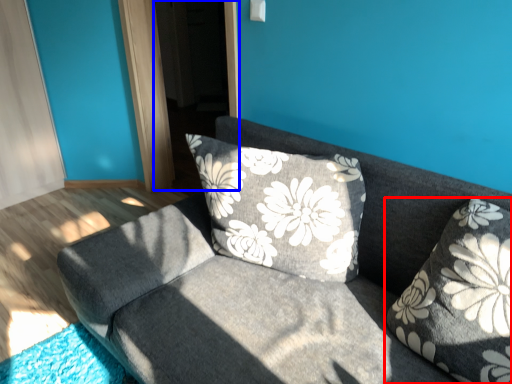
Question: Among these objects, which one is farthest to the camera, pillow (highlighted by a red box) or screen door (highlighted by a blue box)?

Choices:
 (A) pillow
 (B) screen door

Answer: (B)